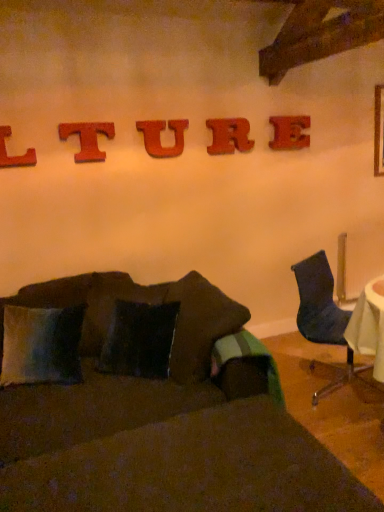
Question: Is red wood u at center, which is counted as the 3th alphabet, starting from the left, bigger than red wood letter t at upper center, the 2th alphabet positioned from the left?

Choices:
 (A) yes
 (B) no

Answer: (A)

Question: Is red wood u at center, which is counted as the 3th alphabet, starting from the left, looking in the opposite direction of red wood letter t at upper center, the fourth alphabet in the right-to-left sequence?

Choices:
 (A) no
 (B) yes

Answer: (A)

Question: Is red wood letter t at upper center, the fourth alphabet in the right-to-left sequence, located within red wood u at center, which ranks as the 3th alphabet in right-to-left order?

Choices:
 (A) no
 (B) yes

Answer: (A)

Question: From the image's perspective, is red wood u at center, which ranks as the 3th alphabet in right-to-left order, beneath red wood letter t at upper center, the fourth alphabet in the right-to-left sequence?

Choices:
 (A) yes
 (B) no

Answer: (B)

Question: Does red wood u at center, which is counted as the 3th alphabet, starting from the left, lie behind red wood letter t at upper center, the fourth alphabet in the right-to-left sequence?

Choices:
 (A) no
 (B) yes

Answer: (B)

Question: Considering the relative positions of red wood letter t at upper center, the 2th alphabet positioned from the left, and red wood letter l at upper left, which is counted as the fifth alphabet, starting from the right, in the image provided, is red wood letter t at upper center, the 2th alphabet positioned from the left, to the left or to the right of red wood letter l at upper left, which is counted as the fifth alphabet, starting from the right,?

Choices:
 (A) right
 (B) left

Answer: (A)

Question: From a real-world perspective, is red wood letter t at upper center, the fourth alphabet in the right-to-left sequence, above or below red wood letter l at upper left, which is counted as the fifth alphabet, starting from the right?

Choices:
 (A) above
 (B) below

Answer: (A)

Question: Looking at their shapes, would you say red wood letter t at upper center, the 2th alphabet positioned from the left, is wider or thinner than red wood letter l at upper left, which ranks as the 1th alphabet in left-to-right order?

Choices:
 (A) thin
 (B) wide

Answer: (A)

Question: Considering the positions of point (62, 134) and point (0, 163), is point (62, 134) closer or farther from the camera than point (0, 163)?

Choices:
 (A) farther
 (B) closer

Answer: (A)

Question: In terms of width, does red wood letter l at upper left, which is counted as the fifth alphabet, starting from the right, look wider or thinner when compared to velvety blue pillow at lower left?

Choices:
 (A) wide
 (B) thin

Answer: (B)

Question: From the image's perspective, relative to velvety blue pillow at lower left, is red wood letter l at upper left, which is counted as the fifth alphabet, starting from the right, above or below?

Choices:
 (A) above
 (B) below

Answer: (A)

Question: Is red wood letter l at upper left, which is counted as the fifth alphabet, starting from the right, in front of or behind velvety blue pillow at lower left in the image?

Choices:
 (A) behind
 (B) front

Answer: (A)

Question: From a real-world perspective, relative to velvety blue pillow at lower left, is red wood letter l at upper left, which is counted as the fifth alphabet, starting from the right, vertically above or below?

Choices:
 (A) below
 (B) above

Answer: (B)

Question: From a real-world perspective, relative to velvety blue pillow at lower left, is wooden letter r at upper center, acting as the fourth alphabet starting from the left, vertically above or below?

Choices:
 (A) below
 (B) above

Answer: (B)

Question: Is wooden letter r at upper center, acting as the fourth alphabet starting from the left, in front of or behind velvety blue pillow at lower left in the image?

Choices:
 (A) front
 (B) behind

Answer: (B)